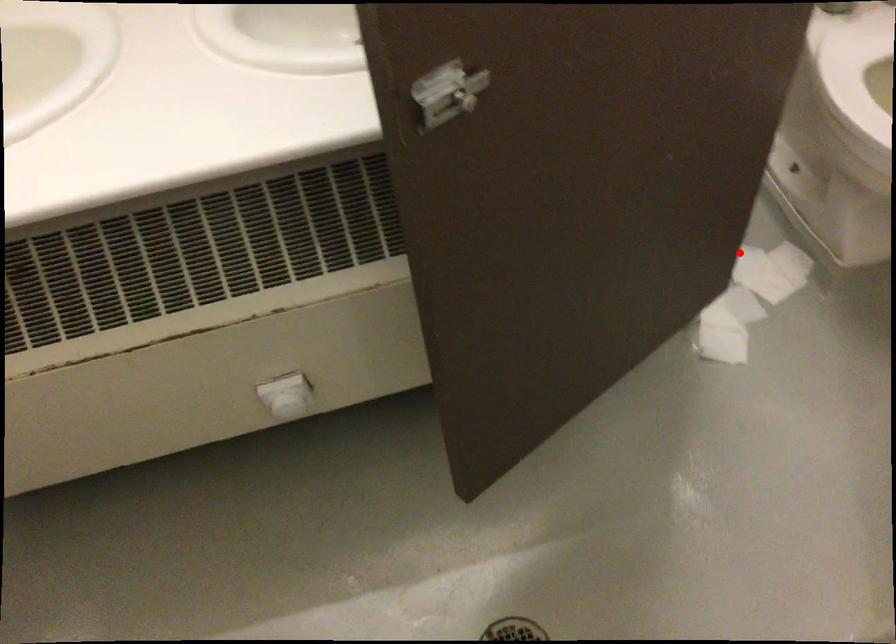
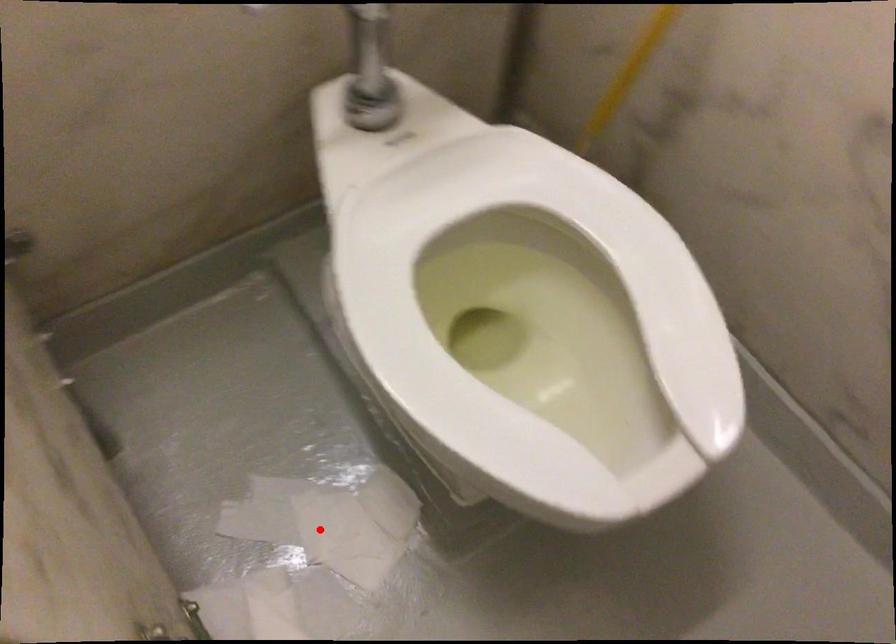
I am providing you with two images of the same scene from different viewpoints. A red point is marked on the first image and another point is marked on the second image. Do the highlighted points in image1 and image2 indicate the same real-world spot?

Yes